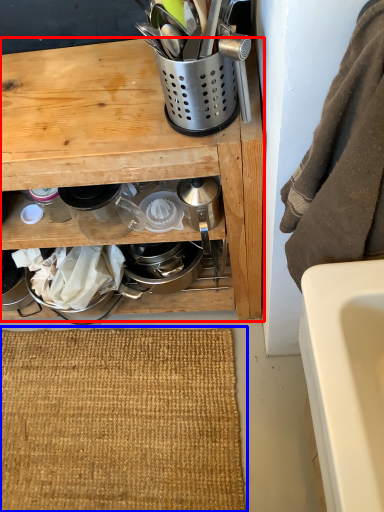
Question: Which object appears closest to the camera in this image, cabinetry (highlighted by a red box) or doormat (highlighted by a blue box)?

Choices:
 (A) cabinetry
 (B) doormat

Answer: (A)